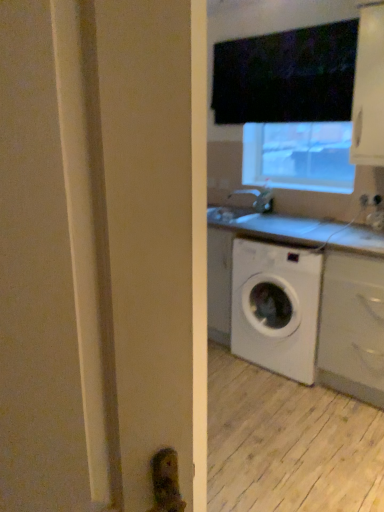
Question: Considering the relative sizes of white matte cabinet at lower right, positioned as the first cabinetry in bottom-to-top order, and white glossy cabinet at upper right, the second cabinetry positioned from the bottom, in the image provided, is white matte cabinet at lower right, positioned as the first cabinetry in bottom-to-top order, taller than white glossy cabinet at upper right, the second cabinetry positioned from the bottom,?

Choices:
 (A) yes
 (B) no

Answer: (A)

Question: Is white matte cabinet at lower right, the 2th cabinetry from the top, thinner than white glossy cabinet at upper right, the first cabinetry positioned from the top?

Choices:
 (A) yes
 (B) no

Answer: (B)

Question: Is white glossy cabinet at upper right, the first cabinetry positioned from the top, located within white matte cabinet at lower right, the 2th cabinetry from the top?

Choices:
 (A) yes
 (B) no

Answer: (B)

Question: Is white matte cabinet at lower right, the 2th cabinetry from the top, at the right side of white glossy cabinet at upper right, the second cabinetry positioned from the bottom?

Choices:
 (A) no
 (B) yes

Answer: (B)

Question: Could you tell me if white matte cabinet at lower right, positioned as the first cabinetry in bottom-to-top order, is facing white glossy cabinet at upper right, the second cabinetry positioned from the bottom?

Choices:
 (A) no
 (B) yes

Answer: (A)

Question: From a real-world perspective, is white plastic electric outlet at upper right physically located above or below matte silver faucet at center?

Choices:
 (A) below
 (B) above

Answer: (B)

Question: In terms of height, does white plastic electric outlet at upper right look taller or shorter compared to matte silver faucet at center?

Choices:
 (A) short
 (B) tall

Answer: (A)

Question: From the image's perspective, relative to matte silver faucet at center, is white plastic electric outlet at upper right above or below?

Choices:
 (A) below
 (B) above

Answer: (A)

Question: Considering the positions of point (370, 201) and point (233, 192), is point (370, 201) closer or farther from the camera than point (233, 192)?

Choices:
 (A) farther
 (B) closer

Answer: (B)

Question: Considering their positions, is white glossy counter at center located in front of or behind white matte cabinet at lower right, the 2th cabinetry from the top?

Choices:
 (A) behind
 (B) front

Answer: (A)

Question: Is white glossy counter at center spatially inside white matte cabinet at lower right, the 2th cabinetry from the top, or outside of it?

Choices:
 (A) inside
 (B) outside

Answer: (B)

Question: Does point (357, 245) appear closer or farther from the camera than point (364, 281)?

Choices:
 (A) closer
 (B) farther

Answer: (A)

Question: Looking at their shapes, would you say white glossy counter at center is wider or thinner than white matte cabinet at lower right, positioned as the first cabinetry in bottom-to-top order?

Choices:
 (A) thin
 (B) wide

Answer: (B)

Question: From a real-world perspective, relative to matte silver faucet at center, is white matte cabinet at lower right, positioned as the first cabinetry in bottom-to-top order, vertically above or below?

Choices:
 (A) above
 (B) below

Answer: (B)

Question: Is white matte cabinet at lower right, the 2th cabinetry from the top, inside or outside of matte silver faucet at center?

Choices:
 (A) outside
 (B) inside

Answer: (A)